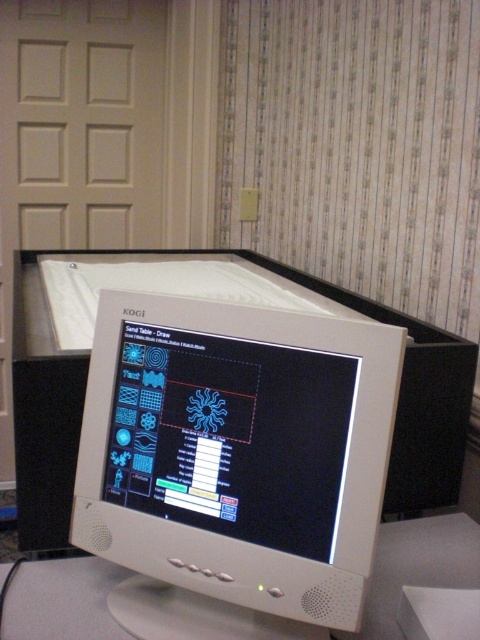
You are setting up a new monitor on the white plastic computer desk at center. The current white plastic monitor at center is already placed. Can the new monitor fit next to the existing one on the desk without overlapping?

The white plastic monitor at center is wider than the white plastic computer desk at center. Since the desk is narrower than the monitor itself, there isn answer not enough space to place another monitor next to the existing one without overlapping.

You are a technician trying to clean the white plastic monitor at center and the white plastic computer desk at center. Since both are white, you need to ensure you don not mix up the cleaning cloths. Which object should you clean first to avoid confusion?

You should clean the white plastic monitor at center first because it is in front of the white plastic computer desk at center, making it more accessible.